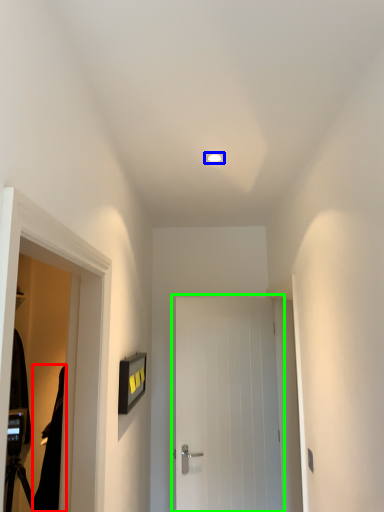
Question: Based on their relative distances, which object is farther from robe (highlighted by a red box)? Choose from lighting (highlighted by a blue box) and door (highlighted by a green box).

Choices:
 (A) lighting
 (B) door

Answer: (A)